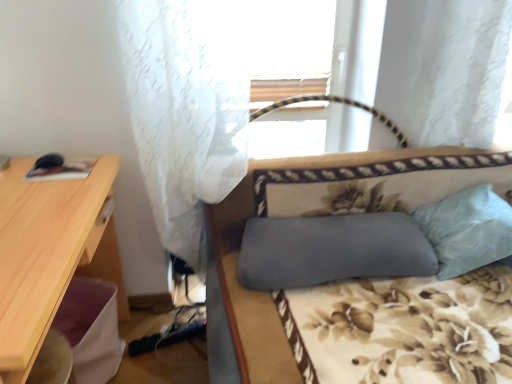
Looking at this image, what is the approximate height of white sheer curtain at upper left?

white sheer curtain at upper left is 1.15 meters in height.

What is the approximate width of light wood desk at left?

light wood desk at left is 20.64 inches wide.

Describe the element at coordinates (267, 292) in the screenshot. This screenshot has height=384, width=512. I see `gray fabric studio couch at center` at that location.

Image resolution: width=512 pixels, height=384 pixels. I want to click on gray fabric studio couch at center, so click(267, 292).

Identify the location of light blue fabric pillow at right, the second pillow positioned from the left. (467, 229).

Is light wood desk at left oriented away from white sheer curtain at upper left?

No, light wood desk at left is not facing away from white sheer curtain at upper left.

Considering the points (25, 222) and (128, 38), which point is in front, point (25, 222) or point (128, 38)?

Positioned in front is point (25, 222).

Which of these two, light wood desk at left or white sheer curtain at upper left, is wider?

With larger width is light wood desk at left.

Consider the image. Is light wood desk at left with white sheer curtain at upper left?

No, light wood desk at left is not touching white sheer curtain at upper left.

From the image's perspective, is gray fabric pillow at center, which is the 1th pillow from left to right, positioned above or below light blue fabric pillow at right, which appears as the first pillow when viewed from the right?

gray fabric pillow at center, which is the 1th pillow from left to right, is situated lower than light blue fabric pillow at right, which appears as the first pillow when viewed from the right, in the image.

Is gray fabric pillow at center, which appears as the second pillow when viewed from the right, not within light blue fabric pillow at right, the second pillow positioned from the left?

Indeed, gray fabric pillow at center, which appears as the second pillow when viewed from the right, is completely outside light blue fabric pillow at right, the second pillow positioned from the left.

From a real-world perspective, is gray fabric pillow at center, which appears as the second pillow when viewed from the right, physically below light blue fabric pillow at right, which appears as the first pillow when viewed from the right?

Yes, from a real-world perspective, gray fabric pillow at center, which appears as the second pillow when viewed from the right, is beneath light blue fabric pillow at right, which appears as the first pillow when viewed from the right.

Is gray fabric pillow at center, which appears as the second pillow when viewed from the right, looking in the opposite direction of light blue fabric pillow at right, the second pillow positioned from the left?

gray fabric pillow at center, which appears as the second pillow when viewed from the right, does not have its back to light blue fabric pillow at right, the second pillow positioned from the left.

Looking at this image, how far apart are light wood desk at left and light blue fabric pillow at right, which appears as the first pillow when viewed from the right?

light wood desk at left is 4.26 feet away from light blue fabric pillow at right, which appears as the first pillow when viewed from the right.

From the image's perspective, is light wood desk at left located above or below light blue fabric pillow at right, the second pillow positioned from the left?

From the image's perspective, light wood desk at left appears below light blue fabric pillow at right, the second pillow positioned from the left.

Which is nearer, (56, 202) or (473, 189)?

Point (56, 202) is positioned closer to the camera compared to point (473, 189).

From a real-world perspective, between light wood desk at left and light blue fabric pillow at right, which appears as the first pillow when viewed from the right, who is vertically lower?

light wood desk at left.

Is light blue fabric pillow at right, which appears as the first pillow when viewed from the right, looking in the opposite direction of light wood desk at left?

No, light blue fabric pillow at right, which appears as the first pillow when viewed from the right, is not facing the opposite direction of light wood desk at left.

Is light blue fabric pillow at right, which appears as the first pillow when viewed from the right, at the left side of light wood desk at left?

No.

Between light blue fabric pillow at right, which appears as the first pillow when viewed from the right, and light wood desk at left, which one has smaller size?

Smaller between the two is light blue fabric pillow at right, which appears as the first pillow when viewed from the right.

How many degrees apart are the facing directions of light blue fabric pillow at right, the second pillow positioned from the left, and light wood desk at left?

87.9 degrees separate the facing orientations of light blue fabric pillow at right, the second pillow positioned from the left, and light wood desk at left.

Is point (44, 298) closer to viewer compared to point (240, 191)?

Yes, it is in front of point (240, 191).

Is gray fabric studio couch at center at the back of light wood desk at left?

No, light wood desk at left's orientation is not away from gray fabric studio couch at center.

From a real-world perspective, is light wood desk at left above or below gray fabric studio couch at center?

Clearly, from a real-world perspective, light wood desk at left is below gray fabric studio couch at center.

Which of these two, light wood desk at left or gray fabric studio couch at center, is bigger?

Bigger between the two is gray fabric studio couch at center.

From the image's perspective, between gray fabric pillow at center, which appears as the second pillow when viewed from the right, and gray fabric studio couch at center, which one is located above?

gray fabric pillow at center, which appears as the second pillow when viewed from the right, is shown above in the image.

Consider the image. Considering the sizes of gray fabric pillow at center, which is the 1th pillow from left to right, and gray fabric studio couch at center in the image, is gray fabric pillow at center, which is the 1th pillow from left to right, taller or shorter than gray fabric studio couch at center?

Considering their sizes, gray fabric pillow at center, which is the 1th pillow from left to right, has less height than gray fabric studio couch at center.

Does gray fabric pillow at center, which appears as the second pillow when viewed from the right, come behind gray fabric studio couch at center?

Yes, gray fabric pillow at center, which appears as the second pillow when viewed from the right, is further from the viewer.

Which object is positioned more to the left, gray fabric pillow at center, which is the 1th pillow from left to right, or gray fabric studio couch at center?

Positioned to the left is gray fabric pillow at center, which is the 1th pillow from left to right.

Which of these two, gray fabric studio couch at center or light blue fabric pillow at right, the second pillow positioned from the left, is bigger?

Bigger between the two is gray fabric studio couch at center.

From the image's perspective, is gray fabric studio couch at center above light blue fabric pillow at right, which appears as the first pillow when viewed from the right?

No.

Can you confirm if gray fabric studio couch at center is positioned to the left of light blue fabric pillow at right, the second pillow positioned from the left?

Indeed, gray fabric studio couch at center is positioned on the left side of light blue fabric pillow at right, the second pillow positioned from the left.

What are the coordinates of `curtain above the light wood desk at left (from the image's perspective)` in the screenshot? It's located at (186, 110).

Find the location of a particular element. The image size is (512, 384). pillow in front of the gray fabric pillow at center, which is the 1th pillow from left to right is located at coordinates (467, 229).

From the picture: Considering their positions, is white sheer curtain at upper left positioned further to light blue fabric pillow at right, which appears as the first pillow when viewed from the right, than light wood desk at left?

Among the two, light wood desk at left is located further to light blue fabric pillow at right, which appears as the first pillow when viewed from the right.

Looking at the image, which one is located closer to light blue fabric pillow at right, the second pillow positioned from the left, light wood desk at left or gray fabric pillow at center, which is the 1th pillow from left to right?

Based on the image, gray fabric pillow at center, which is the 1th pillow from left to right, appears to be nearer to light blue fabric pillow at right, the second pillow positioned from the left.

Which object lies further to the anchor point white sheer curtain at upper left, light blue fabric pillow at right, the second pillow positioned from the left, or gray fabric pillow at center, which is the 1th pillow from left to right?

light blue fabric pillow at right, the second pillow positioned from the left, lies further to white sheer curtain at upper left than the other object.

When comparing their distances from gray fabric pillow at center, which is the 1th pillow from left to right, does gray fabric studio couch at center or white sheer curtain at upper left seem further?

Based on the image, white sheer curtain at upper left appears to be further to gray fabric pillow at center, which is the 1th pillow from left to right.

Looking at the image, which one is located further to white sheer curtain at upper left, light wood desk at left or gray fabric pillow at center, which appears as the second pillow when viewed from the right?

The object further to white sheer curtain at upper left is gray fabric pillow at center, which appears as the second pillow when viewed from the right.

Looking at the image, which one is located further to light wood desk at left, gray fabric studio couch at center or light blue fabric pillow at right, the second pillow positioned from the left?

light blue fabric pillow at right, the second pillow positioned from the left, is positioned further to the anchor light wood desk at left.

Based on their spatial positions, is light wood desk at left or light blue fabric pillow at right, the second pillow positioned from the left, further from gray fabric pillow at center, which appears as the second pillow when viewed from the right?

The object further to gray fabric pillow at center, which appears as the second pillow when viewed from the right, is light wood desk at left.

When comparing their distances from light wood desk at left, does white sheer curtain at upper left or gray fabric studio couch at center seem closer?

Among the two, white sheer curtain at upper left is located nearer to light wood desk at left.

Find the location of a particular element. This screenshot has width=512, height=384. pillow between gray fabric studio couch at center and gray fabric pillow at center, which is the 1th pillow from left to right, in the front-back direction is located at coordinates (467, 229).

Where is `pillow between light wood desk at left and gray fabric studio couch at center`? pillow between light wood desk at left and gray fabric studio couch at center is located at coordinates (332, 250).

The height and width of the screenshot is (384, 512). I want to click on studio couch situated between white sheer curtain at upper left and light blue fabric pillow at right, the second pillow positioned from the left, from left to right, so click(x=267, y=292).

This screenshot has width=512, height=384. What are the coordinates of `pillow between white sheer curtain at upper left and gray fabric studio couch at center` in the screenshot? It's located at (332, 250).